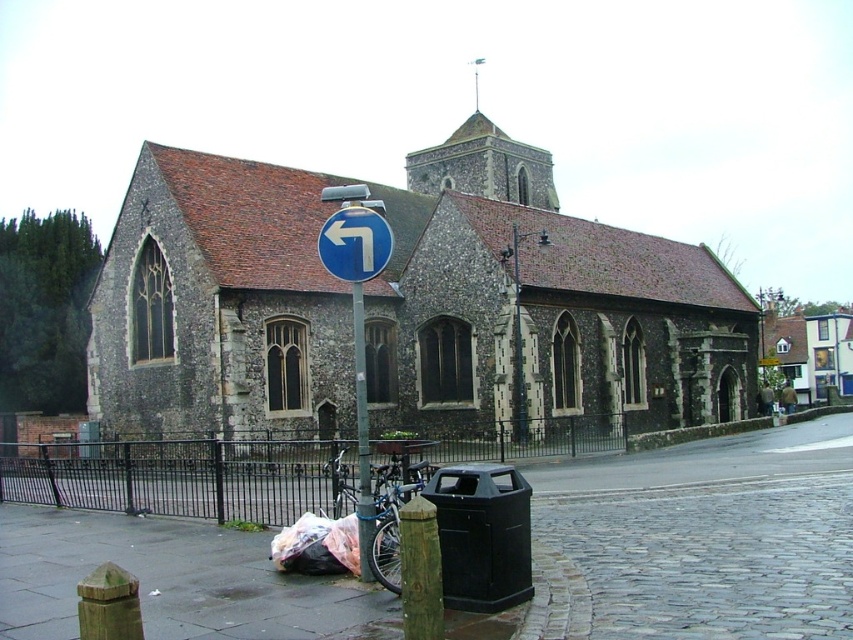
Question: Does blue metallic bicycle at lower left appear over green metallic pole at center?

Choices:
 (A) yes
 (B) no

Answer: (B)

Question: Can you confirm if black metal fence at lower left is wider than blue metallic bicycle at lower left?

Choices:
 (A) yes
 (B) no

Answer: (A)

Question: Among these points, which one is farthest from the camera?

Choices:
 (A) (119, 500)
 (B) (363, 516)
 (C) (422, 460)

Answer: (C)

Question: Does smooth concrete pavement at lower left lie behind blue metallic bicycle at lower left?

Choices:
 (A) yes
 (B) no

Answer: (B)

Question: Which of these objects is positioned closest to the plastic bag at lower left?

Choices:
 (A) blue metallic bicycle at lower left
 (B) blue plastic traffic sign at left
 (C) green metallic pole at center
 (D) blue circular sign at left

Answer: (A)

Question: Among these objects, which one is nearest to the camera?

Choices:
 (A) blue circular sign at left
 (B) green metallic pole at center
 (C) plastic bag at lower left
 (D) black metal fence at lower left

Answer: (A)